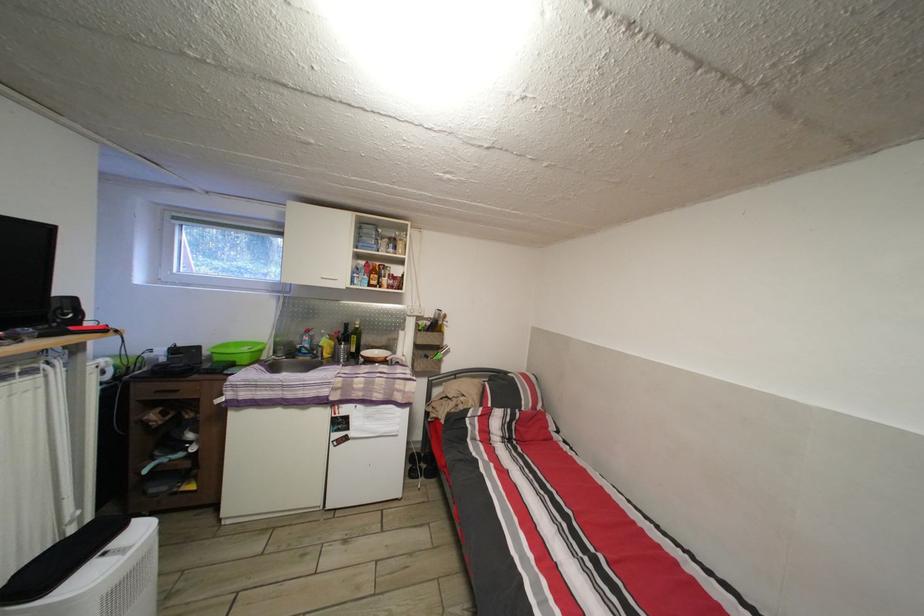
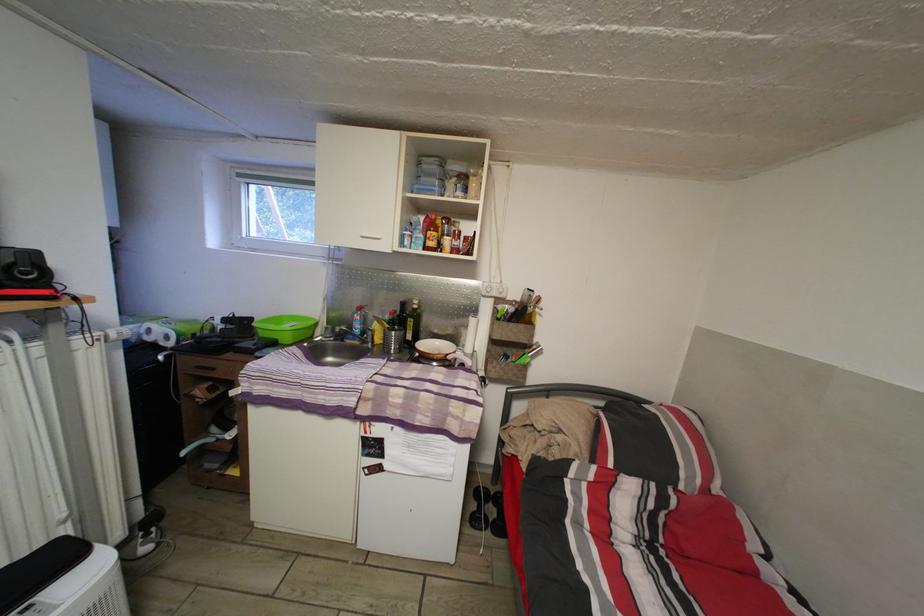
In the second image, find the point that corresponds to point (426, 461) in the first image.

(493, 498)